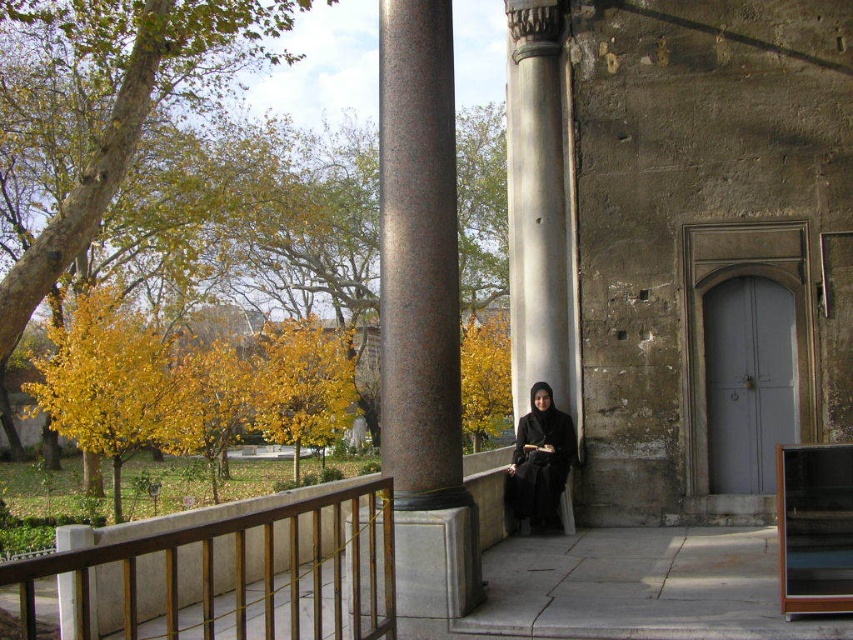
Is polished granite column at center positioned in front of black matte dress at center?

Yes.

Which is behind, point (418, 336) or point (555, 509)?

The point (555, 509) is more distant.

Does point (451, 349) lie behind point (531, 513)?

No, it is not.

At what (x,y) coordinates should I click in order to perform the action: click on polished granite column at center. Please return your answer as a coordinate pair (x, y). This screenshot has height=640, width=853. Looking at the image, I should click on tap(422, 314).

Between brown wood railing at lower left and smooth stone column at center, which one appears on the left side from the viewer's perspective?

brown wood railing at lower left is more to the left.

Which of these two, brown wood railing at lower left or smooth stone column at center, stands taller?

With more height is smooth stone column at center.

Is point (293, 586) less distant than point (535, 317)?

Yes.

Find the location of a particular element. This screenshot has height=640, width=853. brown wood railing at lower left is located at coordinates (230, 576).

The height and width of the screenshot is (640, 853). Describe the element at coordinates (422, 314) in the screenshot. I see `polished granite column at center` at that location.

Does polished granite column at center have a lesser height compared to smooth stone column at center?

Indeed, polished granite column at center has a lesser height compared to smooth stone column at center.

This screenshot has height=640, width=853. I want to click on polished granite column at center, so click(x=422, y=314).

I want to click on polished granite column at center, so click(422, 314).